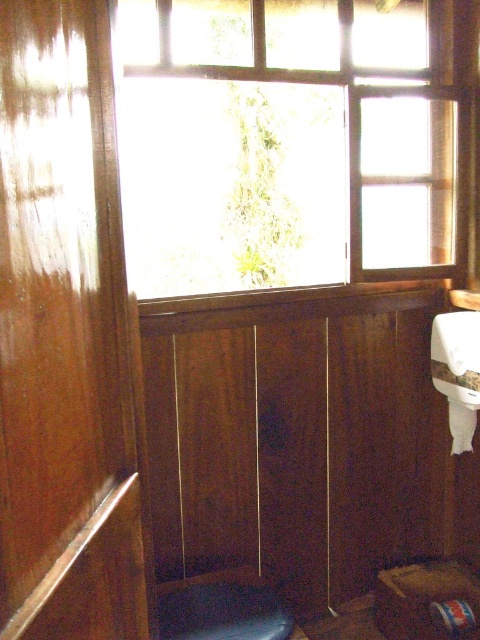
Which of these two, transparent glass window at upper center or dark blue fabric stool at lower center, stands taller?

transparent glass window at upper center

Which is more to the right, transparent glass window at upper center or dark blue fabric stool at lower center?

dark blue fabric stool at lower center is more to the right.

Is point (320, 97) in front of point (179, 611)?

No, it is not.

This screenshot has height=640, width=480. Identify the location of transparent glass window at upper center. (307, 122).